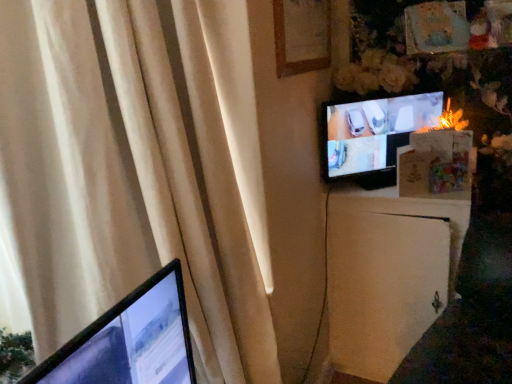
Question: From the image's perspective, is white matte file cabinet at right located above matte black tv at upper right?

Choices:
 (A) yes
 (B) no

Answer: (B)

Question: Is white matte file cabinet at right oriented towards matte black tv at upper right?

Choices:
 (A) no
 (B) yes

Answer: (A)

Question: Considering the relative positions of white matte file cabinet at right and matte black tv at upper right in the image provided, is white matte file cabinet at right to the left of matte black tv at upper right from the viewer's perspective?

Choices:
 (A) yes
 (B) no

Answer: (B)

Question: Is white matte file cabinet at right in contact with matte black tv at upper right?

Choices:
 (A) no
 (B) yes

Answer: (A)

Question: Does white matte file cabinet at right appear on the right side of matte black tv at upper right?

Choices:
 (A) yes
 (B) no

Answer: (A)

Question: Is wooden picture frame at upper center to the left or to the right of white matte file cabinet at right in the image?

Choices:
 (A) left
 (B) right

Answer: (A)

Question: From the image's perspective, is wooden picture frame at upper center positioned above or below white matte file cabinet at right?

Choices:
 (A) above
 (B) below

Answer: (A)

Question: Is point (286, 41) positioned closer to the camera than point (386, 195)?

Choices:
 (A) closer
 (B) farther

Answer: (A)

Question: From their relative heights in the image, would you say wooden picture frame at upper center is taller or shorter than white matte file cabinet at right?

Choices:
 (A) tall
 (B) short

Answer: (B)

Question: Looking at their shapes, would you say wooden picture frame at upper center is wider or thinner than matte black tv at upper right?

Choices:
 (A) wide
 (B) thin

Answer: (B)

Question: In terms of height, does wooden picture frame at upper center look taller or shorter compared to matte black tv at upper right?

Choices:
 (A) tall
 (B) short

Answer: (B)

Question: Considering the positions of point pyautogui.click(x=302, y=8) and point pyautogui.click(x=379, y=168), is point pyautogui.click(x=302, y=8) closer or farther from the camera than point pyautogui.click(x=379, y=168)?

Choices:
 (A) closer
 (B) farther

Answer: (A)

Question: Is wooden picture frame at upper center inside the boundaries of matte black tv at upper right, or outside?

Choices:
 (A) outside
 (B) inside

Answer: (A)

Question: Considering the positions of beige fabric curtain at left and matte black tv at upper right in the image, is beige fabric curtain at left bigger or smaller than matte black tv at upper right?

Choices:
 (A) big
 (B) small

Answer: (A)

Question: In the image, is beige fabric curtain at left positioned in front of or behind matte black tv at upper right?

Choices:
 (A) front
 (B) behind

Answer: (A)